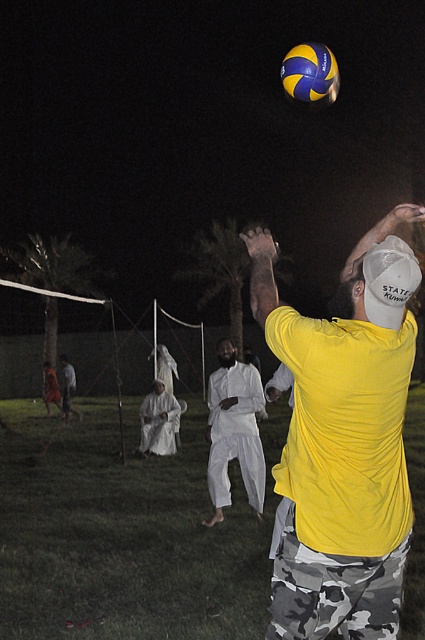
You are a photographer capturing the scene from the upper left corner. You want to focus on the white cotton pants at center and the white mesh baseball cap at upper right. Which object is located to the left of the other?

The white cotton pants at center is positioned on the left side of white mesh baseball cap at upper right.

You are a photographer trying to capture the volleyball game. You notice the yellow matte shirt at upper right and the blue and yellow textured volleyball at upper center. Which object is positioned higher in the image?

The blue and yellow textured volleyball at upper center is positioned higher than the yellow matte shirt at upper right.

You are standing at the origin point in the image. The yellow matte shirt at upper right is located at point (340, 452). If you want to move towards the yellow matte shirt at upper right, in which direction should you move?

The yellow matte shirt at upper right is located at point (340, 452). Since the coordinate system uses x and y values between 0 and 1, moving towards higher x values means moving to the right, and higher y values mean moving upwards. Therefore, to reach the yellow matte shirt at upper right, you should move to the right and upwards.